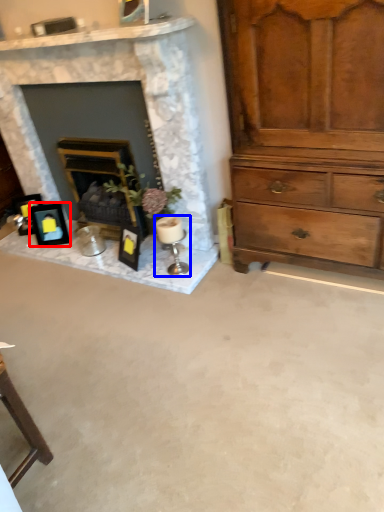
Question: Which object is closer to the camera taking this photo, picture frame (highlighted by a red box) or candle holder (highlighted by a blue box)?

Choices:
 (A) picture frame
 (B) candle holder

Answer: (B)